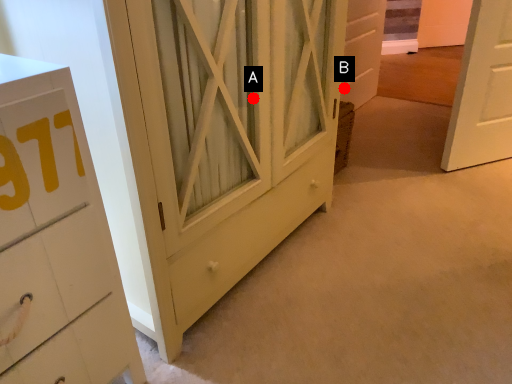
Question: Two points are circled on the image, labeled by A and B beside each circle. Which point is closer to the camera?

Choices:
 (A) A is closer
 (B) B is closer

Answer: (A)